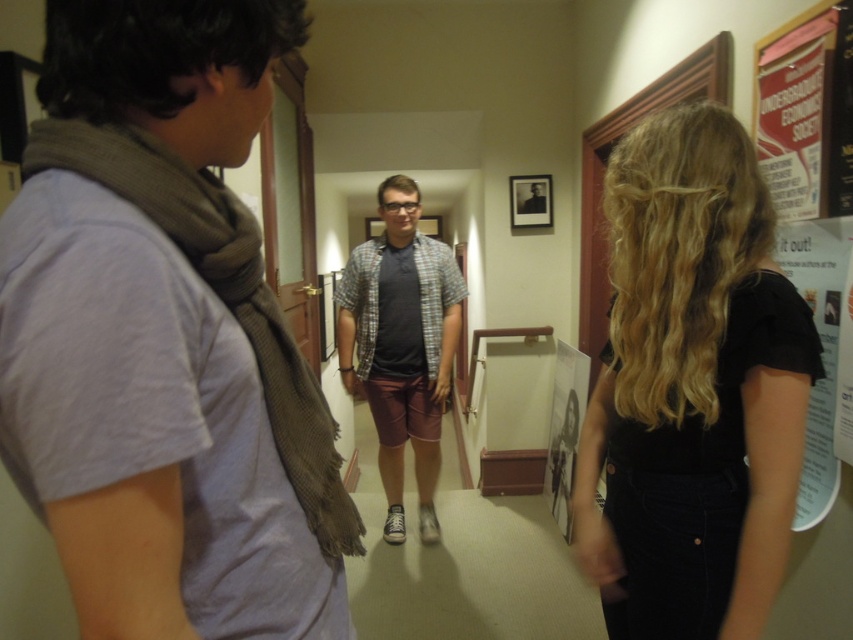
Question: Which of the following is the closest to the observer?

Choices:
 (A) white paper poster at center
 (B) plaid shirt at center
 (C) black velvet shirt at center
 (D) white paper at right

Answer: (C)

Question: Is plaid shirt at center wider than white paper at right?

Choices:
 (A) no
 (B) yes

Answer: (B)

Question: From the image, what is the correct spatial relationship of plaid shirt at center in relation to white paper poster at center?

Choices:
 (A) right
 (B) left

Answer: (B)

Question: Which point is farther from the camera taking this photo?

Choices:
 (A) (709, 312)
 (B) (91, 612)
 (C) (814, 250)

Answer: (C)

Question: Can you confirm if matte gray t-shirt at center is wider than white paper at right?

Choices:
 (A) yes
 (B) no

Answer: (A)

Question: Which point is farther from the camera taking this photo?

Choices:
 (A) (839, 456)
 (B) (567, 536)
 (C) (450, 328)
 (D) (619, 524)

Answer: (B)